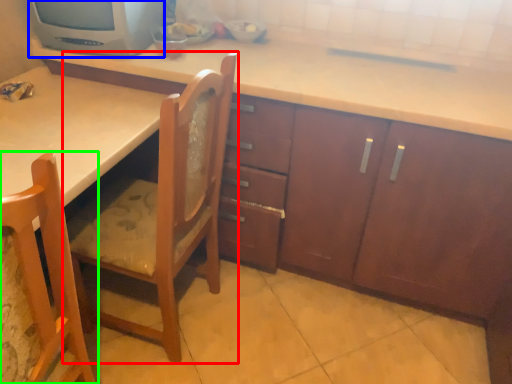
Question: Estimate the real-world distances between objects in this image. Which object is farther from chair (highlighted by a red box), home appliance (highlighted by a blue box) or chair (highlighted by a green box)?

Choices:
 (A) home appliance
 (B) chair

Answer: (A)